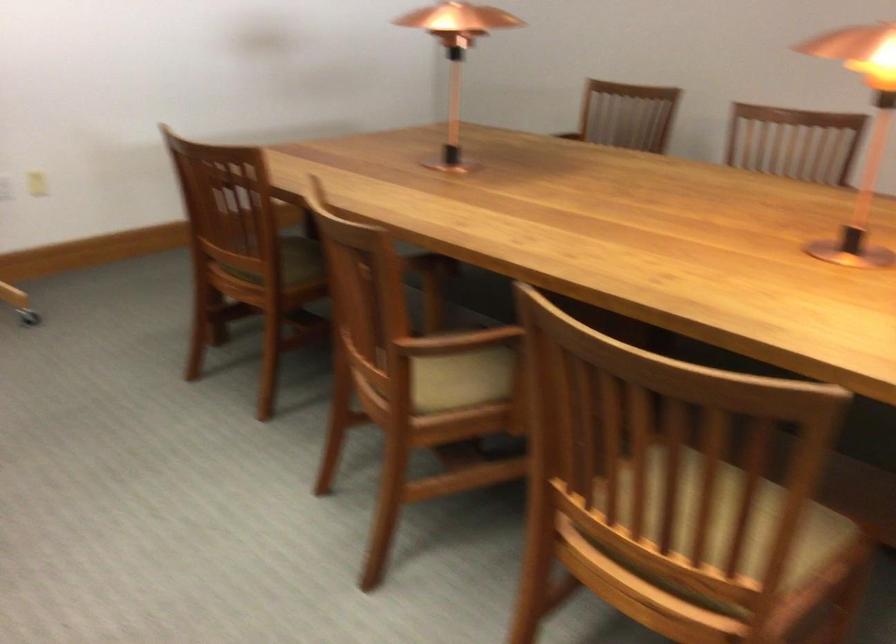
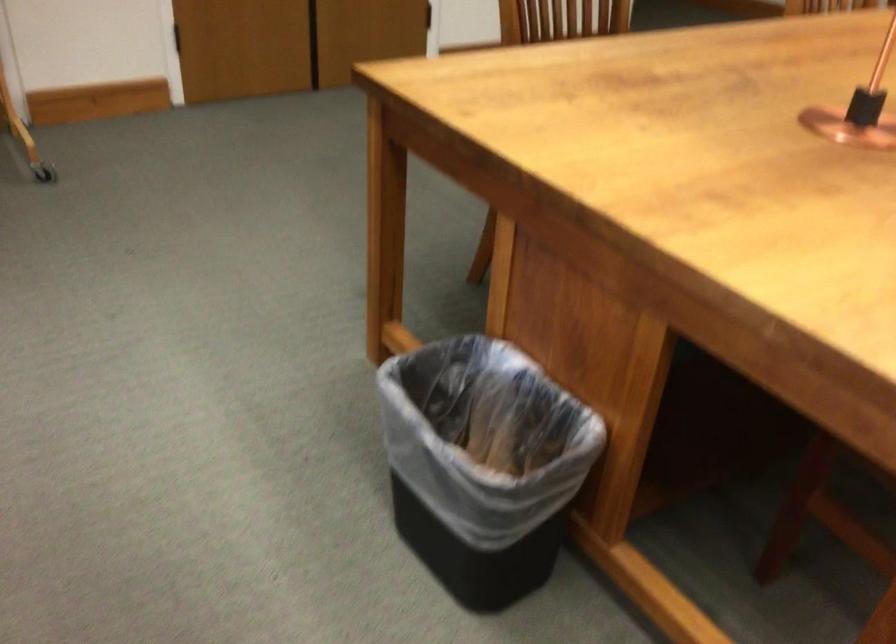
The images are taken continuously from a first-person perspective. In which direction is your viewpoint rotating?

The camera rotated toward left-down.